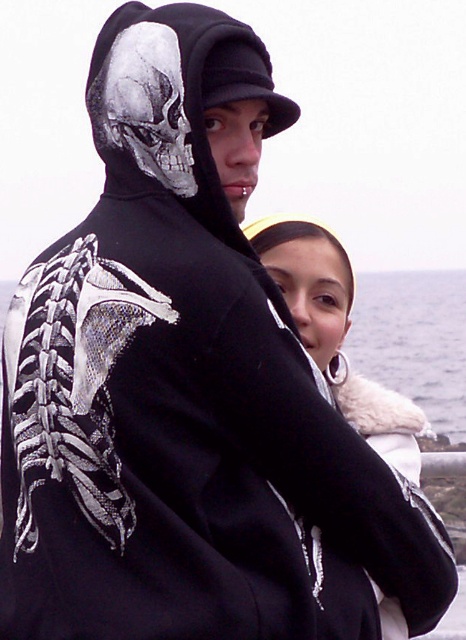
Between point (376, 390) and point (175, 58), which one is positioned behind?

Point (376, 390)

Is smooth white fur at center positioned in front of gray matte skull at upper left?

Yes, smooth white fur at center is in front of gray matte skull at upper left.

Who is more forward, (308, 221) or (152, 67)?

Positioned in front is point (152, 67).

Locate an element on the screen. This screenshot has width=466, height=640. smooth white fur at center is located at coordinates (335, 332).